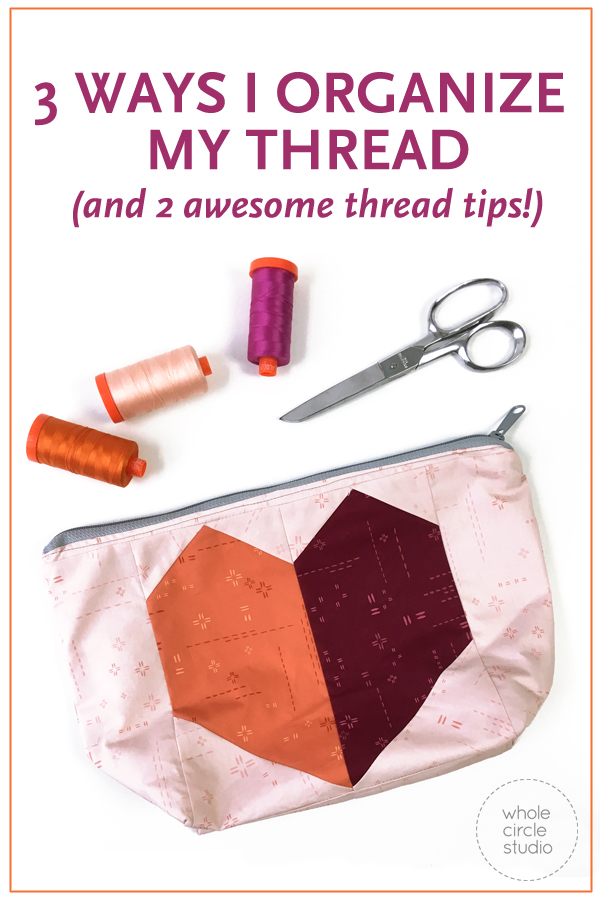
The width and height of the screenshot is (600, 900). What are the coordinates of `fabric` in the screenshot? It's located at (150, 567), (494, 526).